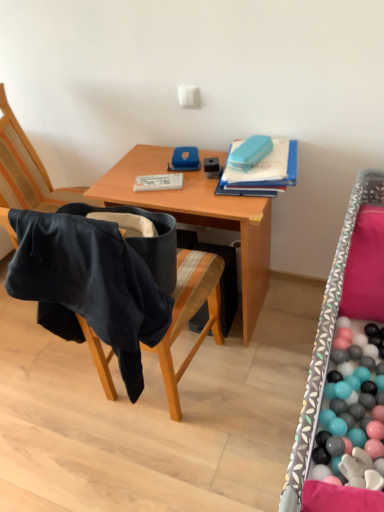
At what (x,y) coordinates should I click in order to perform the action: click on vacant space that's between black fabric chair at left and wooden desk at center. Please return your answer as a coordinate pair (x, y). The height and width of the screenshot is (512, 384). Looking at the image, I should click on (221, 384).